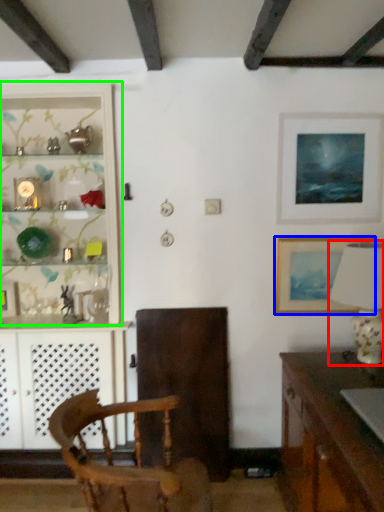
Question: Which is farther away from lamp (highlighted by a red box)? picture frame (highlighted by a blue box) or shelf (highlighted by a green box)?

Choices:
 (A) picture frame
 (B) shelf

Answer: (B)